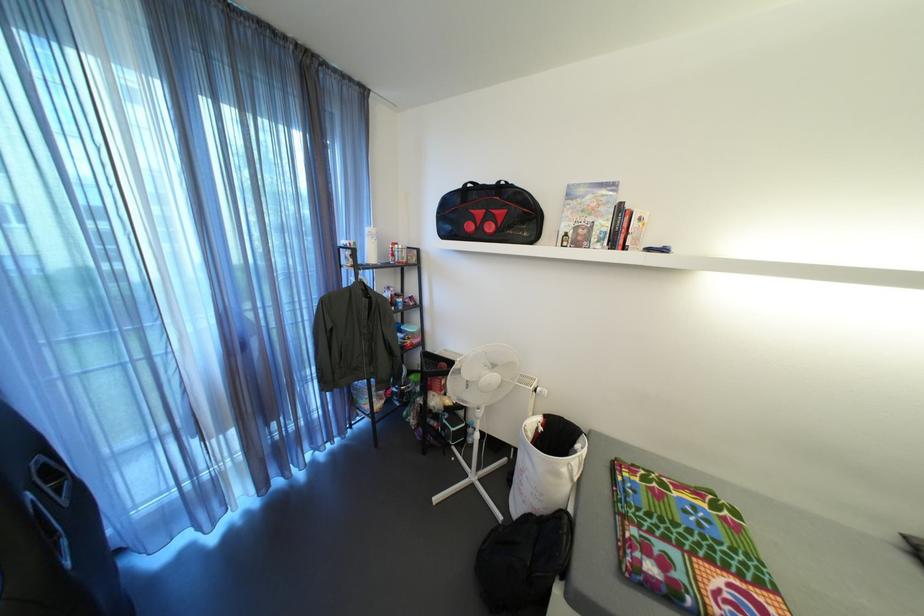
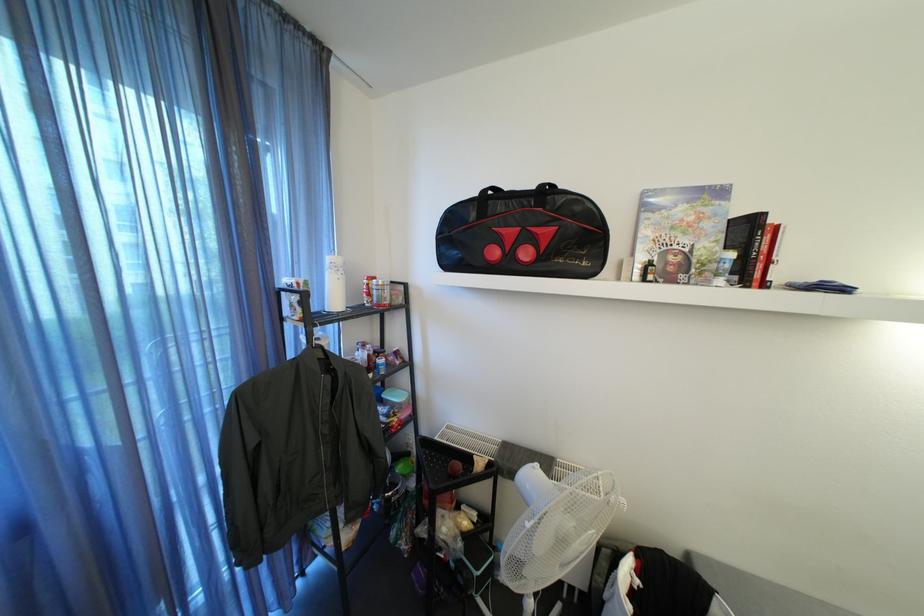
Which direction would the cameraman need to move to produce the second image?

The cameraman walked toward left, forward.